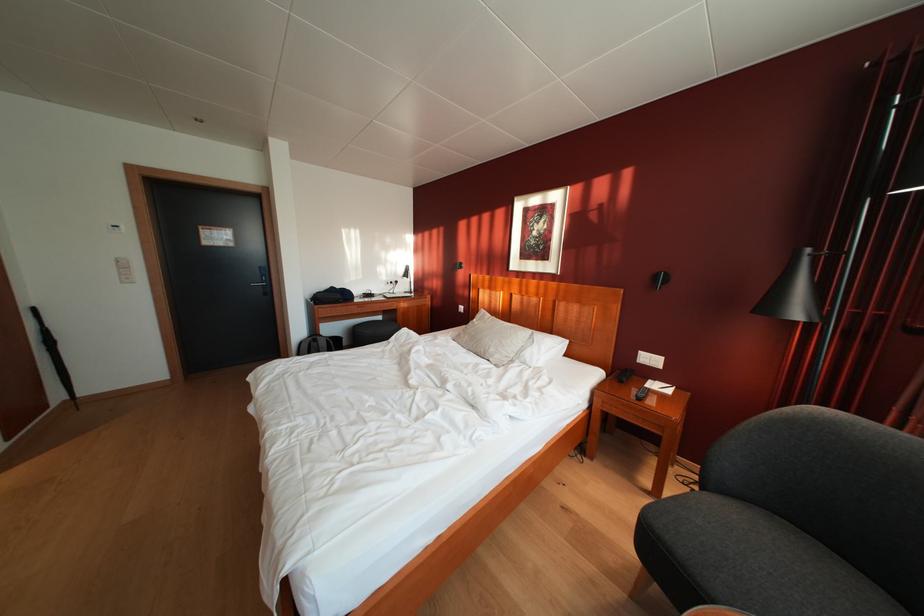
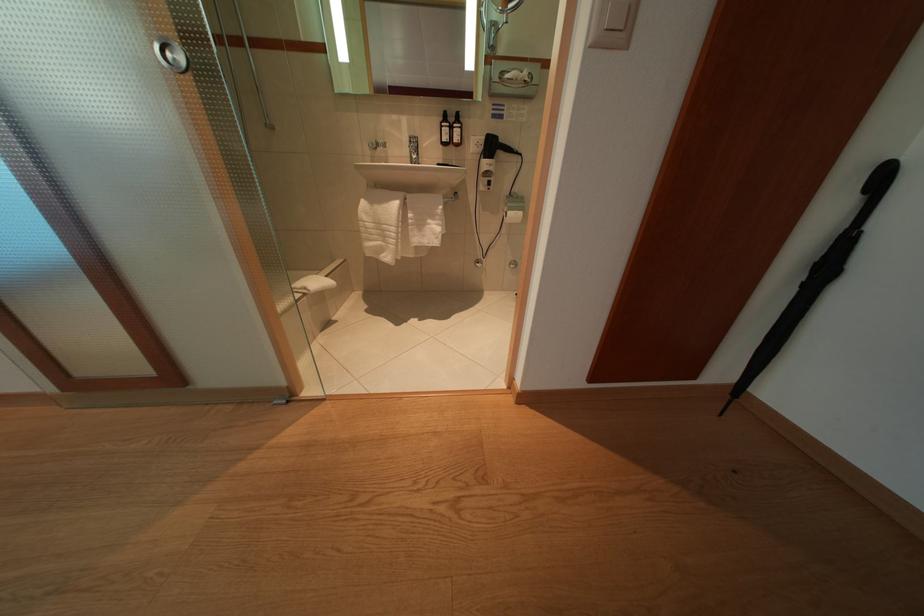
Find the pixel in the second image that matches (x=57, y=349) in the first image.

(834, 275)